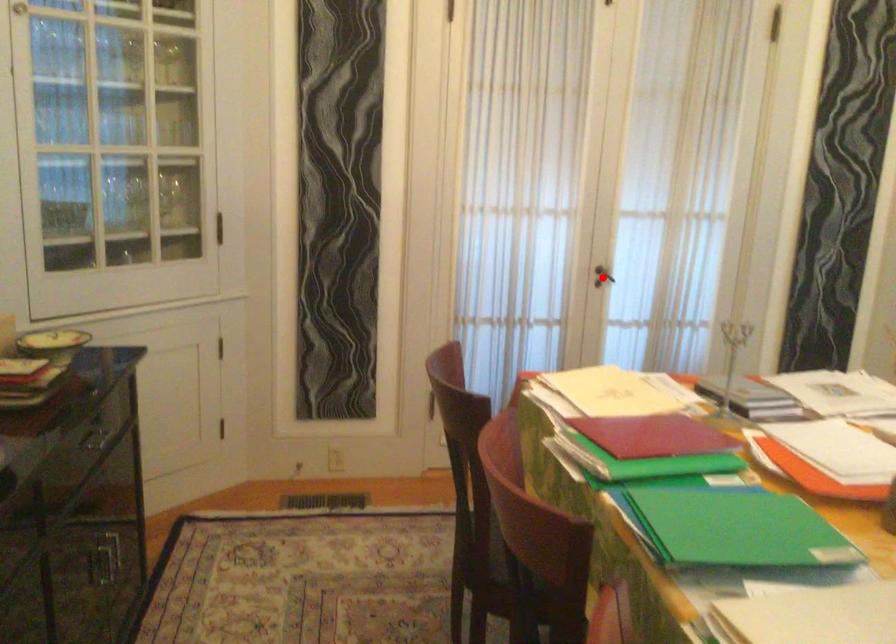
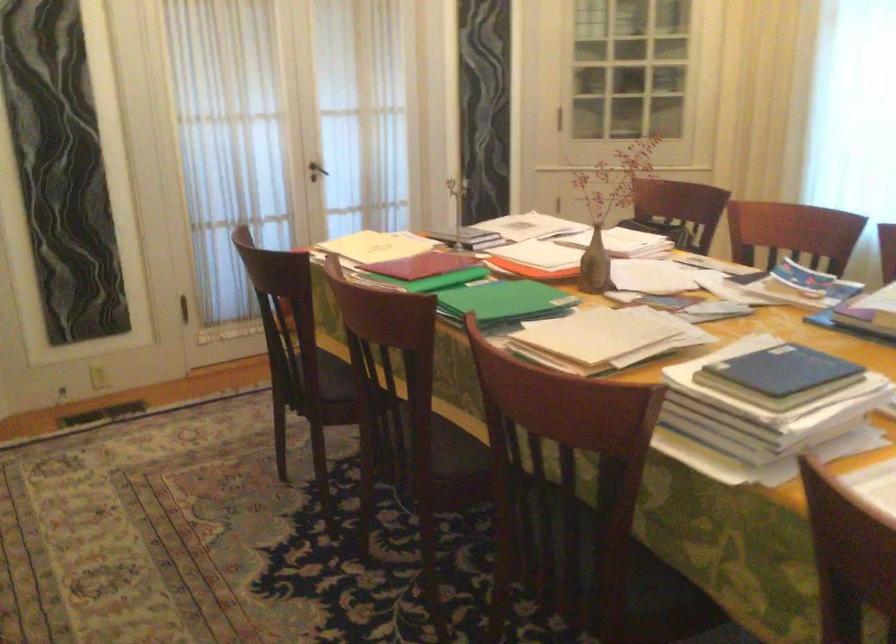
Where in the second image is the point corresponding to the highlighted location from the first image?

(316, 171)